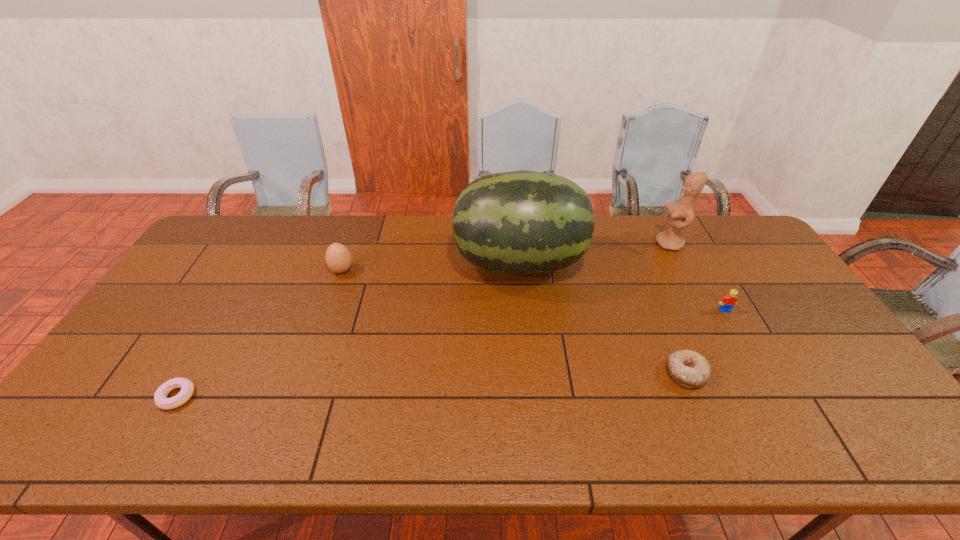
Locate an element on the screen. free space between the Lego and the leftmost object is located at coordinates (451, 353).

Where is `free space between the watermelon and the fourth object from left to right`? The width and height of the screenshot is (960, 540). free space between the watermelon and the fourth object from left to right is located at coordinates (603, 318).

You are a GUI agent. You are given a task and a screenshot of the screen. Output one action in this format:
    pyautogui.click(x=<x>, y=<y>)
    Task: Click on the free space between the figurine and the watermelon
    
    Given the screenshot: What is the action you would take?
    pyautogui.click(x=594, y=253)

Find the location of a particular element. This screenshot has width=960, height=540. unoccupied position between the taller doughnut and the Lego is located at coordinates (706, 342).

Identify which object is located as the third nearest to the boiled egg. Please provide its 2D coordinates. Your answer should be formatted as a tuple, i.e. [(x, y)], where the tuple contains the x and y coordinates of a point satisfying the conditions above.

[(688, 368)]

Locate an element on the screen. The image size is (960, 540). object that is the nearest to the fourth farthest object is located at coordinates (688, 368).